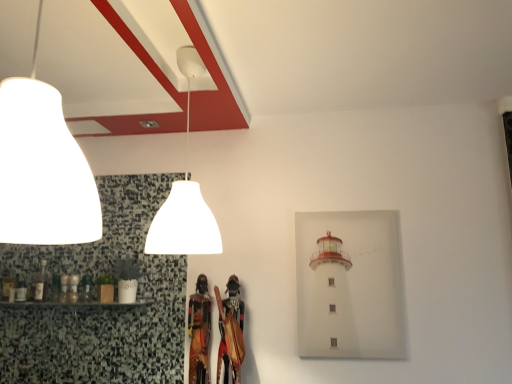
Question: Considering their positions, is white matte lampshade at upper center, the 2th lamp in the front-to-back sequence, located in front of or behind matte white lampshade at upper left, marked as the second lamp in a back-to-front arrangement?

Choices:
 (A) front
 (B) behind

Answer: (B)

Question: In terms of size, does white matte lampshade at upper center, the 2th lamp in the front-to-back sequence, appear bigger or smaller than matte white lampshade at upper left, marked as the second lamp in a back-to-front arrangement?

Choices:
 (A) big
 (B) small

Answer: (A)

Question: Considering the positions of white matte lampshade at upper center, positioned as the first lamp in back-to-front order, and matte white lampshade at upper left, marked as the second lamp in a back-to-front arrangement, in the image, is white matte lampshade at upper center, positioned as the first lamp in back-to-front order, taller or shorter than matte white lampshade at upper left, marked as the second lamp in a back-to-front arrangement,?

Choices:
 (A) short
 (B) tall

Answer: (B)

Question: Is matte white lampshade at upper left, marked as the second lamp in a back-to-front arrangement, taller or shorter than white matte lampshade at upper center, the 2th lamp in the front-to-back sequence?

Choices:
 (A) short
 (B) tall

Answer: (A)

Question: From the image's perspective, relative to white matte lampshade at upper center, positioned as the first lamp in back-to-front order, is matte white lampshade at upper left, marked as the second lamp in a back-to-front arrangement, above or below?

Choices:
 (A) above
 (B) below

Answer: (A)

Question: Is matte white lampshade at upper left, marked as the second lamp in a back-to-front arrangement, spatially inside white matte lampshade at upper center, positioned as the first lamp in back-to-front order, or outside of it?

Choices:
 (A) inside
 (B) outside

Answer: (B)

Question: Looking at the image, does matte white lampshade at upper left, marked as the second lamp in a back-to-front arrangement, seem bigger or smaller compared to white matte lampshade at upper center, the 2th lamp in the front-to-back sequence?

Choices:
 (A) small
 (B) big

Answer: (A)